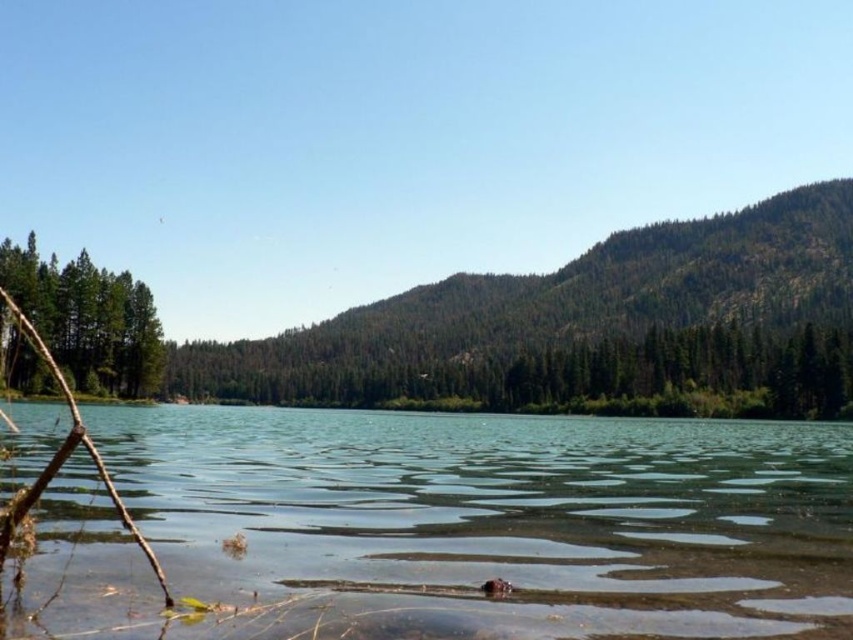
Does green forested mountain at center appear under green matte tree at left?

Actually, green forested mountain at center is above green matte tree at left.

In the scene shown: Does green forested mountain at center appear over green matte tree at left?

Indeed, green forested mountain at center is positioned over green matte tree at left.

Where is `green forested mountain at center`? green forested mountain at center is located at coordinates (589, 330).

Does green forested mountain at center have a greater height compared to brown wood twig at left?

Yes, green forested mountain at center is taller than brown wood twig at left.

Does green forested mountain at center have a lesser width compared to brown wood twig at left?

No.

Describe the element at coordinates (589, 330) in the screenshot. I see `green forested mountain at center` at that location.

You are a GUI agent. You are given a task and a screenshot of the screen. Output one action in this format:
    pyautogui.click(x=<x>, y=<y>)
    Task: Click on the green forested mountain at center
    
    Given the screenshot: What is the action you would take?
    pyautogui.click(x=589, y=330)

Between clear water at center and brown wood twig at left, which one is positioned higher?

Positioned higher is brown wood twig at left.

Between point (723, 604) and point (74, 422), which one is positioned in front?

Point (74, 422) is in front.

Which is behind, point (311, 616) or point (55, 365)?

The point (55, 365) is more distant.

Where is `clear water at center`? This screenshot has width=853, height=640. clear water at center is located at coordinates (491, 522).